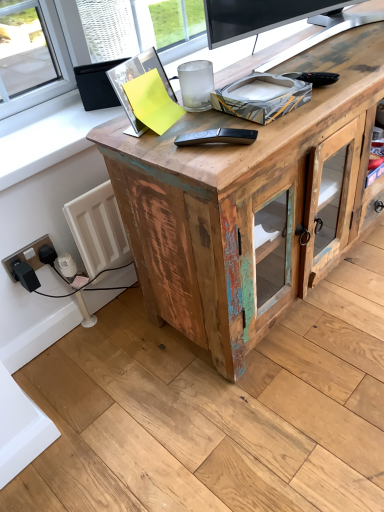
The width and height of the screenshot is (384, 512). What do you see at coordinates (218, 137) in the screenshot?
I see `black plastic remote control at center` at bounding box center [218, 137].

Where is `weathered wood desk at center`? weathered wood desk at center is located at coordinates (248, 202).

Measure the distance between point (11,266) and camera.

Result: Point (11,266) is 3.79 feet away from camera.

Identify the location of black plastic remote control at center. (218, 137).

Considering the positions of point (218, 142) and point (160, 161), is point (218, 142) closer or farther from the camera than point (160, 161)?

Point (218, 142) appears to be closer to the viewer than point (160, 161).

Would you say black plastic remote control at center is a long distance from weathered wood desk at center?

No, black plastic remote control at center is not far from weathered wood desk at center.

Considering the relative positions of black plastic remote control at center and weathered wood desk at center in the image provided, is black plastic remote control at center to the right of weathered wood desk at center from the viewer's perspective?

No.

How much distance is there between weathered wood desk at center and black plastic remote control at center?

The distance of weathered wood desk at center from black plastic remote control at center is 12.53 inches.

Is weathered wood desk at center bigger than black plastic remote control at center?

Correct, weathered wood desk at center is larger in size than black plastic remote control at center.

Is weathered wood desk at center inside the boundaries of black plastic remote control at center, or outside?

weathered wood desk at center lies outside black plastic remote control at center.

Identify the location of desk in front of the black plastic remote control at center. (248, 202).

Would you say black plastic socket at lower left contains weathered wood desk at center?

No, weathered wood desk at center is located outside of black plastic socket at lower left.

Is black plastic socket at lower left in front of or behind weathered wood desk at center in the image?

black plastic socket at lower left is positioned farther from the viewer than weathered wood desk at center.

Can you confirm if black plastic socket at lower left is smaller than weathered wood desk at center?

Yes, black plastic socket at lower left is smaller than weathered wood desk at center.

From a real-world perspective, which object stands above the other?

From a 3D spatial view, weathered wood desk at center is above.

Considering the positions of point (136, 245) and point (10, 272), is point (136, 245) closer or farther from the camera than point (10, 272)?

Point (136, 245) is farther from the camera than point (10, 272).

Considering the relative sizes of weathered wood desk at center and black plastic socket at lower left in the image provided, is weathered wood desk at center bigger than black plastic socket at lower left?

Yes, weathered wood desk at center is bigger than black plastic socket at lower left.

Is weathered wood desk at center oriented towards black plastic socket at lower left?

No, weathered wood desk at center is not turned towards black plastic socket at lower left.

Does black plastic socket at lower left have a greater width compared to black plastic remote control at center?

In fact, black plastic socket at lower left might be narrower than black plastic remote control at center.

Is black plastic remote control at center surrounded by black plastic socket at lower left?

No, black plastic remote control at center is located outside of black plastic socket at lower left.

How distant is black plastic socket at lower left from black plastic remote control at center?

black plastic socket at lower left is 23.50 inches from black plastic remote control at center.

Would you say black plastic remote control at center is outside black plastic socket at lower left?

Indeed, black plastic remote control at center is completely outside black plastic socket at lower left.

In terms of width, does black plastic remote control at center look wider or thinner when compared to black plastic socket at lower left?

Considering their sizes, black plastic remote control at center looks broader than black plastic socket at lower left.

From a real-world perspective, relative to black plastic socket at lower left, is black plastic remote control at center vertically above or below?

From a real-world perspective, black plastic remote control at center is physically above black plastic socket at lower left.

Is black plastic remote control at center oriented away from black plastic socket at lower left?

No.

Locate an element on the screen. This screenshot has width=384, height=512. equipment located on the left of weathered wood desk at center is located at coordinates (218, 137).

What are the coordinates of `desk directly beneath the black plastic remote control at center (from a real-world perspective)` in the screenshot? It's located at (248, 202).

Based on their spatial positions, is black plastic remote control at center or weathered wood desk at center further from black plastic socket at lower left?

weathered wood desk at center is further to black plastic socket at lower left.

From the image, which object appears to be farther from weathered wood desk at center, black plastic socket at lower left or black plastic remote control at center?

black plastic socket at lower left is positioned further to the anchor weathered wood desk at center.

Based on the photo, considering their positions, is weathered wood desk at center positioned closer to black plastic remote control at center than black plastic socket at lower left?

weathered wood desk at center lies closer to black plastic remote control at center than the other object.

Which object lies further to the anchor point weathered wood desk at center, black plastic remote control at center or black plastic socket at lower left?

Answer: black plastic socket at lower left is further to weathered wood desk at center.

Which object lies nearer to the anchor point black plastic remote control at center, black plastic socket at lower left or weathered wood desk at center?

The object closer to black plastic remote control at center is weathered wood desk at center.

From the image, which object appears to be nearer to black plastic socket at lower left, weathered wood desk at center or black plastic remote control at center?

Based on the image, black plastic remote control at center appears to be nearer to black plastic socket at lower left.

Identify the location of equipment situated between black plastic socket at lower left and weathered wood desk at center from left to right. (218, 137).